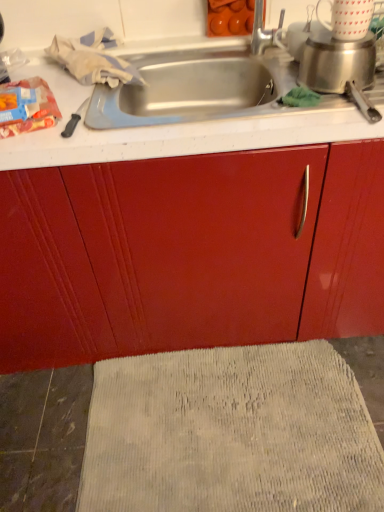
What are the coordinates of `beige textured bath mat at lower center` in the screenshot? It's located at (231, 433).

What do you see at coordinates (231, 433) in the screenshot?
I see `beige textured bath mat at lower center` at bounding box center [231, 433].

What is the approximate height of matte plastic bag of chips at left?

matte plastic bag of chips at left is 1.66 inches tall.

The image size is (384, 512). Describe the element at coordinates (26, 106) in the screenshot. I see `matte plastic bag of chips at left` at that location.

Identify the location of matte plastic bag of chips at left. This screenshot has height=512, width=384. (26, 106).

The height and width of the screenshot is (512, 384). In order to click on beige textured bath mat at lower center in this screenshot , I will do `click(231, 433)`.

Visually, is beige textured bath mat at lower center positioned to the left or to the right of matte plastic bag of chips at left?

beige textured bath mat at lower center is to the right of matte plastic bag of chips at left.

In the image, is beige textured bath mat at lower center positioned in front of or behind matte plastic bag of chips at left?

Visually, beige textured bath mat at lower center is located behind matte plastic bag of chips at left.

Is point (334, 502) closer to camera compared to point (21, 121)?

No.

From the image's perspective, is beige textured bath mat at lower center located beneath matte plastic bag of chips at left?

Correct, beige textured bath mat at lower center appears lower than matte plastic bag of chips at left in the image.

Looking at this image, from a real-world perspective, which object rests below the other?

In real-world perspective, beige textured bath mat at lower center is lower.

Does beige textured bath mat at lower center have a greater width compared to matte plastic bag of chips at left?

Correct, the width of beige textured bath mat at lower center exceeds that of matte plastic bag of chips at left.

Based on the photo, does beige textured bath mat at lower center have a lesser height compared to matte plastic bag of chips at left?

Incorrect, the height of beige textured bath mat at lower center does not fall short of that of matte plastic bag of chips at left.

Which of these two, beige textured bath mat at lower center or matte plastic bag of chips at left, is smaller?

matte plastic bag of chips at left.

Is beige textured bath mat at lower center not within matte plastic bag of chips at left?

Indeed, beige textured bath mat at lower center is completely outside matte plastic bag of chips at left.

Consider the image. Is beige textured bath mat at lower center not near matte plastic bag of chips at left?

That's right, there is a large distance between beige textured bath mat at lower center and matte plastic bag of chips at left.

Is beige textured bath mat at lower center aimed at matte plastic bag of chips at left?

No, beige textured bath mat at lower center is not facing towards matte plastic bag of chips at left.

How different are the orientations of beige textured bath mat at lower center and matte plastic bag of chips at left in degrees?

The angular difference between beige textured bath mat at lower center and matte plastic bag of chips at left is 18.7 degrees.

Find the location of a particular element. This screenshot has width=384, height=512. food on the left of beige textured bath mat at lower center is located at coordinates coord(26,106).

Consider the image. Based on their positions, is matte plastic bag of chips at left located to the left or right of beige textured bath mat at lower center?

In the image, matte plastic bag of chips at left appears on the left side of beige textured bath mat at lower center.

Is matte plastic bag of chips at left in front of or behind beige textured bath mat at lower center in the image?

Visually, matte plastic bag of chips at left is located in front of beige textured bath mat at lower center.

Between point (9, 106) and point (83, 476), which one is positioned behind?

The point (83, 476) is farther from the camera.

From the image's perspective, is matte plastic bag of chips at left on beige textured bath mat at lower center?

Correct, matte plastic bag of chips at left appears higher than beige textured bath mat at lower center in the image.

From a real-world perspective, which is physically above, matte plastic bag of chips at left or beige textured bath mat at lower center?

matte plastic bag of chips at left, from a real-world perspective.

Considering the relative sizes of matte plastic bag of chips at left and beige textured bath mat at lower center in the image provided, is matte plastic bag of chips at left wider than beige textured bath mat at lower center?

In fact, matte plastic bag of chips at left might be narrower than beige textured bath mat at lower center.

In the scene shown: Which of these two, matte plastic bag of chips at left or beige textured bath mat at lower center, stands shorter?

matte plastic bag of chips at left.

Between matte plastic bag of chips at left and beige textured bath mat at lower center, which one has smaller size?

Smaller between the two is matte plastic bag of chips at left.

Is beige textured bath mat at lower center inside matte plastic bag of chips at left?

No, beige textured bath mat at lower center is not a part of matte plastic bag of chips at left.

Is matte plastic bag of chips at left not close to beige textured bath mat at lower center?

matte plastic bag of chips at left is positioned a significant distance from beige textured bath mat at lower center.

Based on the photo, is matte plastic bag of chips at left positioned with its back to beige textured bath mat at lower center?

No, beige textured bath mat at lower center is not at the back of matte plastic bag of chips at left.

How different are the orientations of matte plastic bag of chips at left and beige textured bath mat at lower center in degrees?

18.7 degrees separate the facing orientations of matte plastic bag of chips at left and beige textured bath mat at lower center.

At what (x,y) coordinates should I click in order to perform the action: click on food above the beige textured bath mat at lower center (from the image's perspective). Please return your answer as a coordinate pair (x, y). Looking at the image, I should click on (26, 106).

Where is `food above the beige textured bath mat at lower center (from the image's perspective)`? Image resolution: width=384 pixels, height=512 pixels. food above the beige textured bath mat at lower center (from the image's perspective) is located at coordinates (26, 106).

This screenshot has width=384, height=512. Identify the location of bath mat that is below the matte plastic bag of chips at left (from the image's perspective). (231, 433).